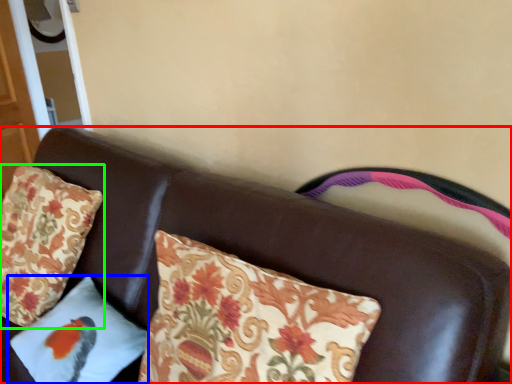
Question: Considering the real-world distances, which object is closest to furniture (highlighted by a red box)? pillow (highlighted by a blue box) or pillow (highlighted by a green box).

Choices:
 (A) pillow
 (B) pillow

Answer: (A)